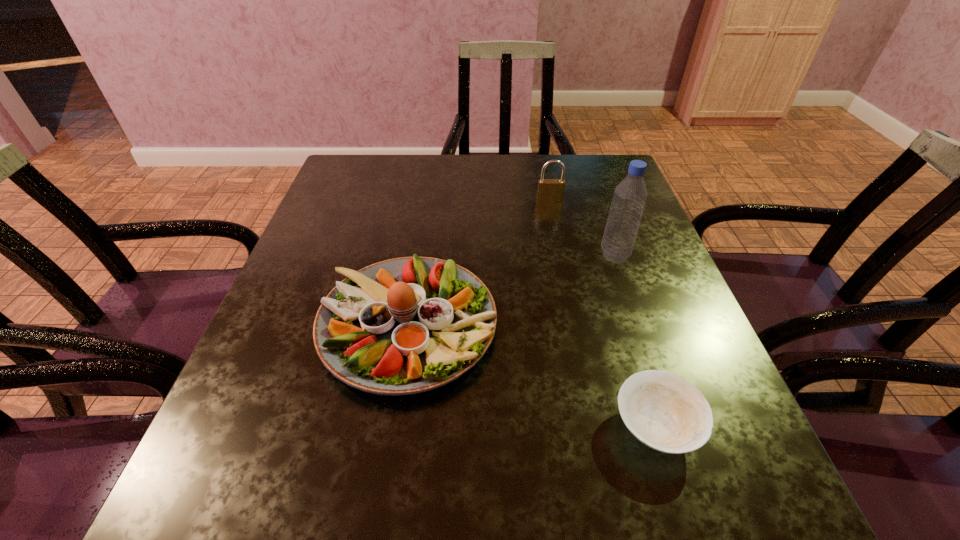
Find the location of a particular element. This screenshot has height=540, width=960. vacant area that lies between the shortest object and the third nearest object is located at coordinates (635, 341).

Where is `free point between the farthest object and the bowl`? free point between the farthest object and the bowl is located at coordinates (603, 313).

Identify the location of free space between the tallest object and the farthest object. (582, 228).

Where is `free space between the bottle and the farthest object`? The width and height of the screenshot is (960, 540). free space between the bottle and the farthest object is located at coordinates (582, 228).

At what (x,y) coordinates should I click in order to perform the action: click on free spot between the bowl and the leftmost object. Please return your answer as a coordinate pair (x, y). The width and height of the screenshot is (960, 540). Looking at the image, I should click on (532, 376).

Identify the location of unoccupied area between the padlock and the bottle. The height and width of the screenshot is (540, 960). (582, 228).

Identify the location of free space between the salad plate and the padlock. (479, 263).

Where is `vacant point located between the padlock and the bowl`? vacant point located between the padlock and the bowl is located at coordinates (603, 313).

You are a GUI agent. You are given a task and a screenshot of the screen. Output one action in this format:
    pyautogui.click(x=<x>, y=<y>)
    Task: Click on the free space between the bowl and the tallest object
    Image resolution: width=960 pixels, height=540 pixels.
    Given the screenshot: What is the action you would take?
    pyautogui.click(x=635, y=341)

Identify the location of vacant region between the salad plate and the second farthest object. (512, 291).